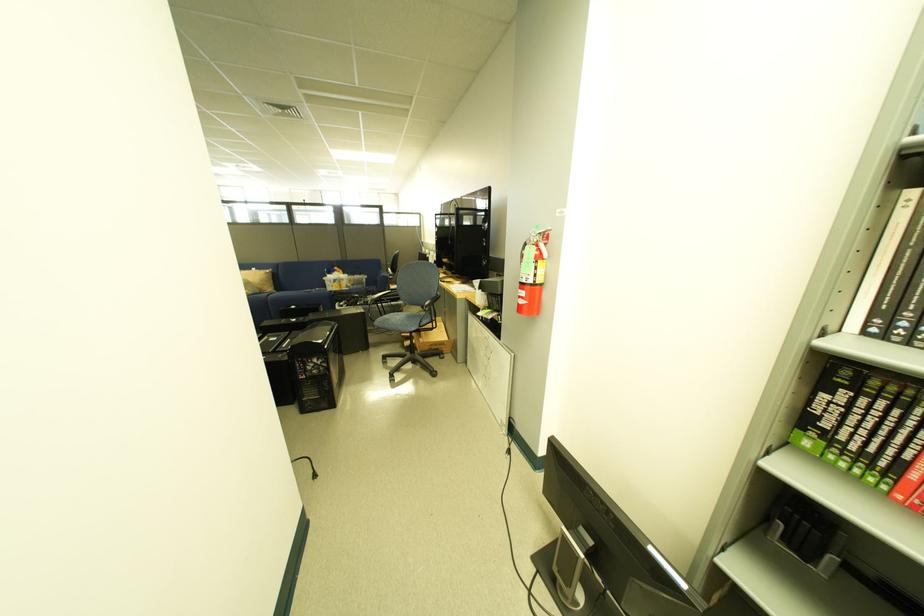
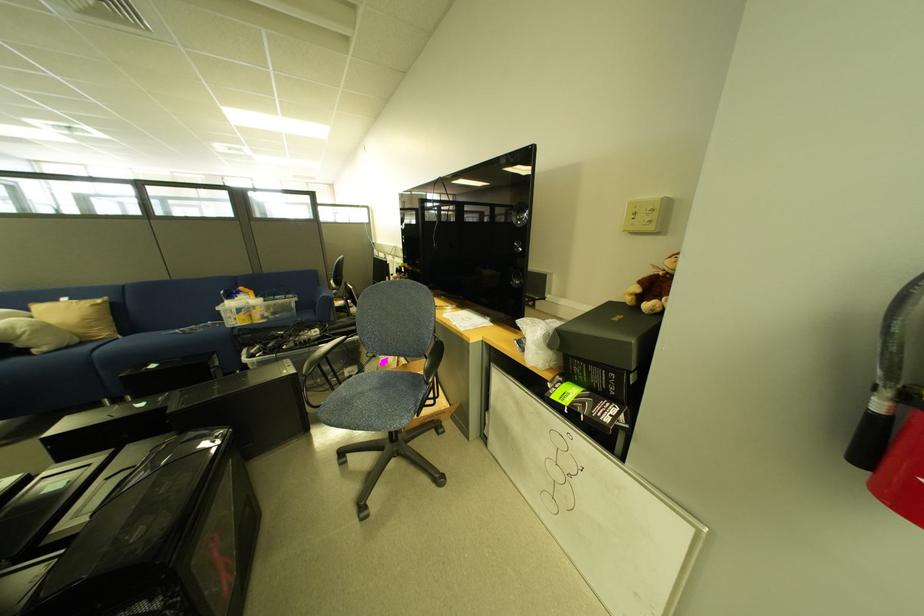
Find the pixel in the second image that matches [358,277] in the first image.

(272, 302)